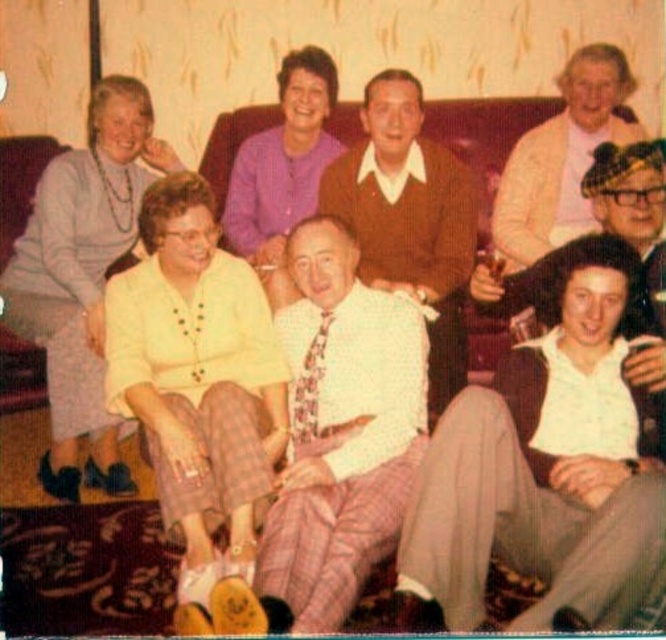
You are standing in the living room and want to move from the point at coordinates point (214, 580) to the point at coordinates point (490, 253). Can you walk directly between them without needing to go around any obstacles?

Point (214, 580) is in front of point (490, 253), so there is no obstacle between them. You can walk directly between them.

From the picture: In the image of the group seated in a mid 20th century living room, where the yellow fabric blouse at center and the clear plastic cup at center right are both visible, which object is positioned more to the right?

The clear plastic cup at center right is positioned more to the right than the yellow fabric blouse at center.

You are a photographer trying to capture a clear shot of the white textured shirt at center and the brown sweater at center. Since you want to focus on the clothing items, which one should you adjust your camera lens to focus on first based on their height?

The white textured shirt at center is shorter than the brown sweater at center, so you should focus on the white textured shirt at center first as it is closer to the camera.